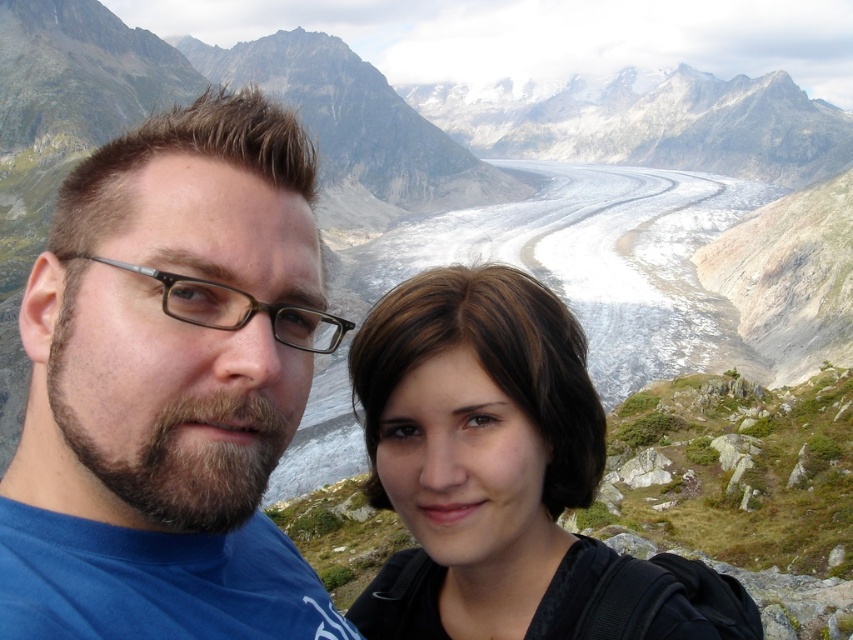
You are a photographer trying to frame a shot of the bearded man with glasses at left and the brown hair at center. Which subject should you adjust your camera focus on first if you want to ensure both are in focus, considering their sizes?

The bearded man with glasses at left is thinner than brown hair at center, so you should focus on the bearded man with glasses at left first to ensure both are in focus.